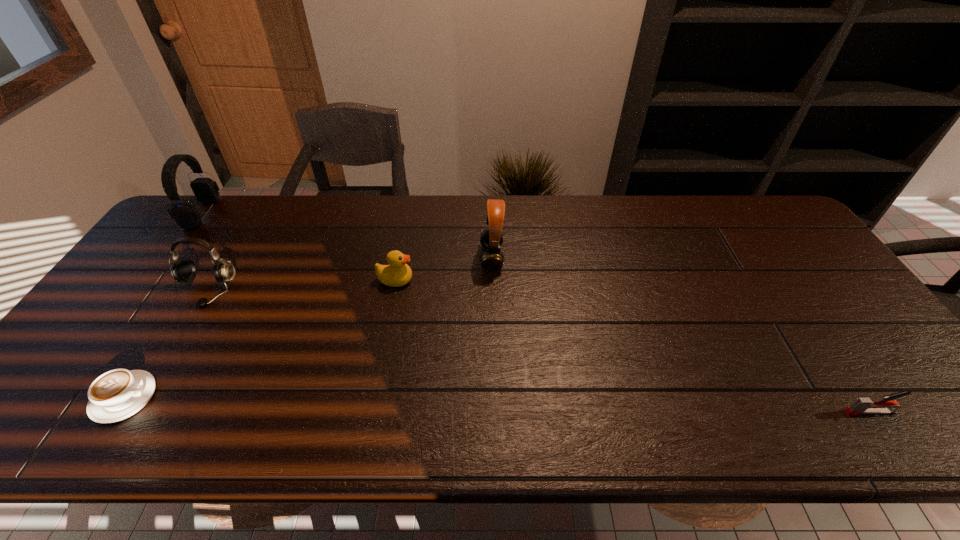
Identify the location of object present at the far edge. This screenshot has width=960, height=540. (186, 215).

At what (x,y) coordinates should I click in order to perform the action: click on stapler that is positioned at the near edge. Please return your answer as a coordinate pair (x, y). This screenshot has width=960, height=540. Looking at the image, I should click on (863, 405).

Locate an element on the screen. The image size is (960, 540). cappuccino that is at the near edge is located at coordinates (116, 395).

Find the location of `headset at the left edge`. headset at the left edge is located at coordinates (186, 215).

The image size is (960, 540). What are the coordinates of `cappuccino that is at the left edge` in the screenshot? It's located at (116, 395).

This screenshot has width=960, height=540. I want to click on object positioned at the right edge, so click(x=863, y=405).

The width and height of the screenshot is (960, 540). I want to click on object that is at the far left corner, so click(186, 215).

Find the location of a particular element. The width and height of the screenshot is (960, 540). object that is positioned at the near left corner is located at coordinates (116, 395).

You are a GUI agent. You are given a task and a screenshot of the screen. Output one action in this format:
    pyautogui.click(x=<x>, y=<y>)
    Task: Click on the object situated at the near right corner
    Image resolution: width=960 pixels, height=540 pixels.
    Given the screenshot: What is the action you would take?
    pyautogui.click(x=863, y=405)

Locate an element on the screen. free point at the far edge is located at coordinates (714, 225).